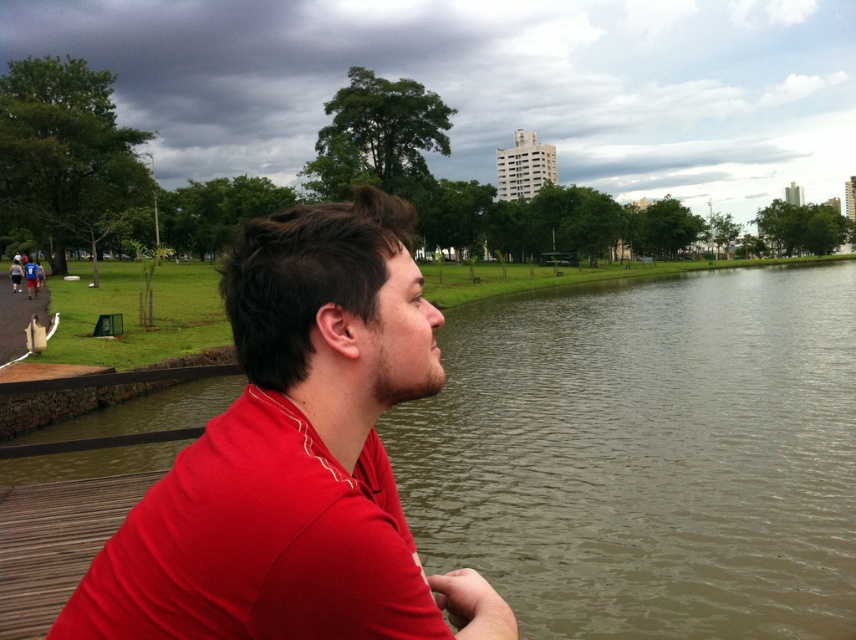
Is point (310, 500) positioned before point (247, 522)?

Yes, point (310, 500) is closer to viewer.

Can you confirm if matte red shirt at center is wider than matte red polo shirt at center?

Yes, matte red shirt at center is wider than matte red polo shirt at center.

What do you see at coordinates (295, 458) in the screenshot? I see `matte red shirt at center` at bounding box center [295, 458].

Identify the location of matte red shirt at center. This screenshot has height=640, width=856. (295, 458).

Is the position of brown murky water at center less distant than that of matte red polo shirt at center?

No, it is behind matte red polo shirt at center.

Is point (651, 518) positioned after point (253, 518)?

Yes, it is.

The width and height of the screenshot is (856, 640). I want to click on brown murky water at center, so click(646, 454).

Can you confirm if brown murky water at center is shorter than matte red shirt at center?

No.

Is brown murky water at center taller than matte red shirt at center?

Yes, brown murky water at center is taller than matte red shirt at center.

Is point (758, 509) behind point (205, 627)?

Yes, point (758, 509) is farther from viewer.

The image size is (856, 640). Find the location of `brown murky water at center`. brown murky water at center is located at coordinates (646, 454).